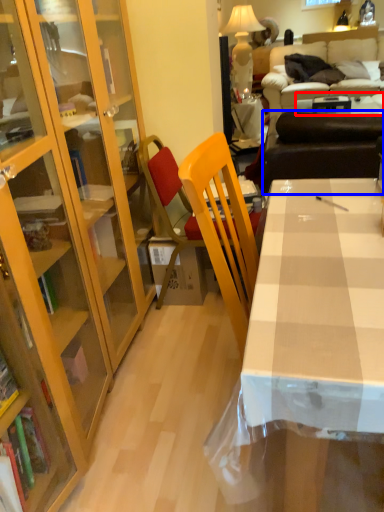
Question: Which point is closer to the camera, table (highlighted by a red box) or studio couch (highlighted by a blue box)?

Choices:
 (A) table
 (B) studio couch

Answer: (B)